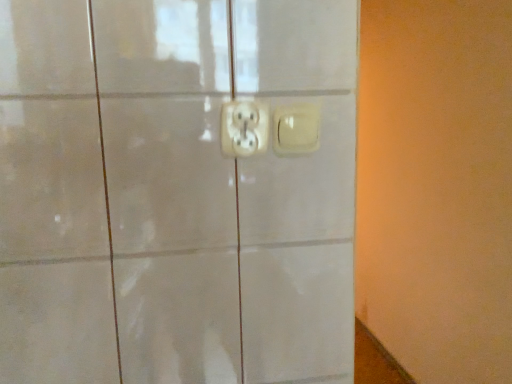
Image resolution: width=512 pixels, height=384 pixels. Describe the element at coordinates (296, 129) in the screenshot. I see `matte white switch at center` at that location.

Find the location of a particular element. This screenshot has height=384, width=512. matte white switch at center is located at coordinates (296, 129).

Measure the distance between point (x=256, y=146) and camera.

They are 26.38 inches apart.

What do you see at coordinates (244, 128) in the screenshot? I see `white plastic power plug and socket at center` at bounding box center [244, 128].

This screenshot has width=512, height=384. I want to click on white plastic power plug and socket at center, so click(x=244, y=128).

The image size is (512, 384). Identify the location of matte white switch at center. (296, 129).

In the image, is matte white switch at center on the left side or the right side of white plastic power plug and socket at center?

From the image, it's evident that matte white switch at center is to the right of white plastic power plug and socket at center.

In the image, is matte white switch at center positioned in front of or behind white plastic power plug and socket at center?

matte white switch at center is positioned farther from the viewer than white plastic power plug and socket at center.

Does point (293, 126) lie behind point (260, 138)?

That is True.

From the image's perspective, who appears lower, matte white switch at center or white plastic power plug and socket at center?

matte white switch at center is shown below in the image.

From a real-world perspective, is matte white switch at center physically below white plastic power plug and socket at center?

Indeed, from a real-world perspective, matte white switch at center is positioned beneath white plastic power plug and socket at center.

Which object is wider, matte white switch at center or white plastic power plug and socket at center?

With larger width is matte white switch at center.

Considering the relative sizes of matte white switch at center and white plastic power plug and socket at center in the image provided, is matte white switch at center taller than white plastic power plug and socket at center?

No.

Considering the sizes of objects matte white switch at center and white plastic power plug and socket at center in the image provided, who is smaller, matte white switch at center or white plastic power plug and socket at center?

Smaller between the two is matte white switch at center.

Is matte white switch at center outside of white plastic power plug and socket at center?

matte white switch at center lies outside white plastic power plug and socket at center's area.

Is matte white switch at center positioned far away from white plastic power plug and socket at center?

That's not correct — matte white switch at center is a little close to white plastic power plug and socket at center.

Based on the photo, is matte white switch at center facing towards white plastic power plug and socket at center?

No, matte white switch at center does not turn towards white plastic power plug and socket at center.

How many degrees apart are the facing directions of matte white switch at center and white plastic power plug and socket at center?

There is a 0.058-degree angle between the facing directions of matte white switch at center and white plastic power plug and socket at center.

Locate an element on the screen. The width and height of the screenshot is (512, 384). light switch lying behind the white plastic power plug and socket at center is located at coordinates (296, 129).

Would you say white plastic power plug and socket at center is to the left or to the right of matte white switch at center in the picture?

Clearly, white plastic power plug and socket at center is on the left of matte white switch at center in the image.

Does white plastic power plug and socket at center lie in front of matte white switch at center?

That is True.

Considering the positions of point (221, 144) and point (289, 152), is point (221, 144) closer or farther from the camera than point (289, 152)?

Point (221, 144) is closer to the camera than point (289, 152).

From the image's perspective, is white plastic power plug and socket at center positioned above or below matte white switch at center?

Clearly, from the image's perspective, white plastic power plug and socket at center is above matte white switch at center.

From a real-world perspective, is white plastic power plug and socket at center positioned over matte white switch at center based on gravity?

Yes, from a real-world perspective, white plastic power plug and socket at center is over matte white switch at center

Considering the relative sizes of white plastic power plug and socket at center and matte white switch at center in the image provided, is white plastic power plug and socket at center wider than matte white switch at center?

No.

Does white plastic power plug and socket at center have a greater height compared to matte white switch at center?

Indeed, white plastic power plug and socket at center has a greater height compared to matte white switch at center.

Is white plastic power plug and socket at center bigger than matte white switch at center?

Yes, white plastic power plug and socket at center is bigger than matte white switch at center.

Is white plastic power plug and socket at center surrounding matte white switch at center?

Definitely not — matte white switch at center is not inside white plastic power plug and socket at center.

Is white plastic power plug and socket at center not near matte white switch at center?

No, white plastic power plug and socket at center is not far from matte white switch at center.

Is white plastic power plug and socket at center turned away from matte white switch at center?

white plastic power plug and socket at center does not have its back to matte white switch at center.

How many degrees apart are the facing directions of white plastic power plug and socket at center and matte white switch at center?

0.058 degrees separate the facing orientations of white plastic power plug and socket at center and matte white switch at center.

Identify the location of light switch on the right side of white plastic power plug and socket at center. Image resolution: width=512 pixels, height=384 pixels. (296, 129).

You are a GUI agent. You are given a task and a screenshot of the screen. Output one action in this format:
    pyautogui.click(x=<x>, y=<y>)
    Task: Click on the power plugs and sockets above the matte white switch at center (from the image's perspective)
    Image resolution: width=512 pixels, height=384 pixels.
    Given the screenshot: What is the action you would take?
    pyautogui.click(x=244, y=128)

This screenshot has width=512, height=384. What are the coordinates of `power plugs and sockets on the left of the matte white switch at center` in the screenshot? It's located at (244, 128).